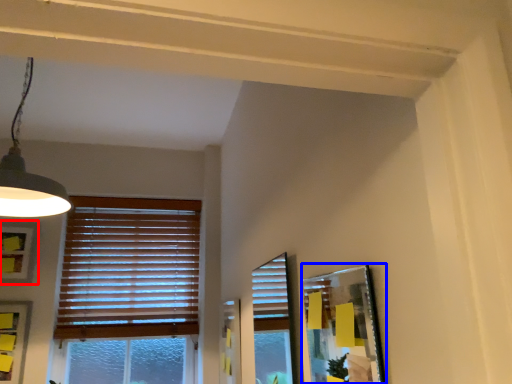
Question: Which of the following is the closest to the observer, picture frame (highlighted by a red box) or picture frame (highlighted by a blue box)?

Choices:
 (A) picture frame
 (B) picture frame

Answer: (B)